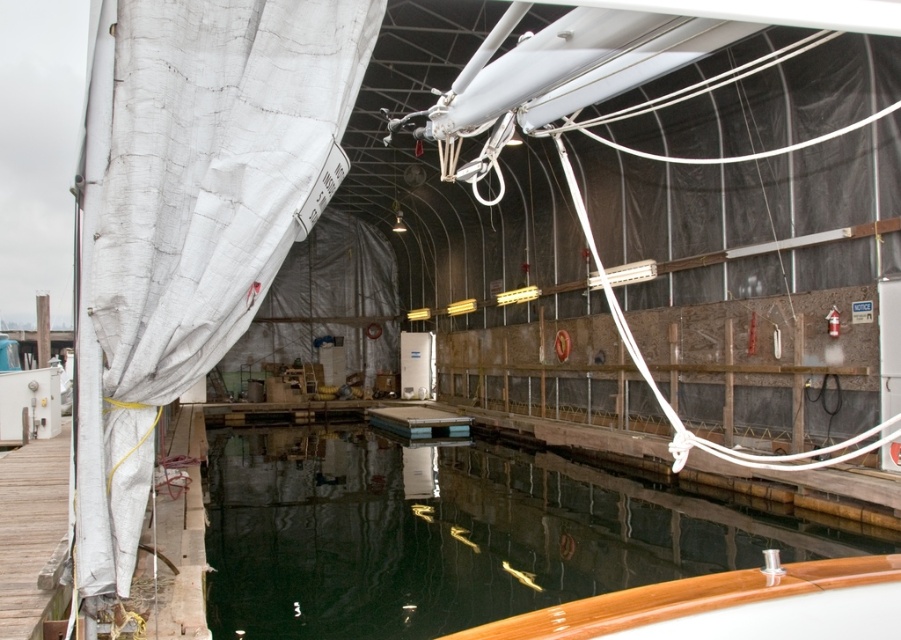
Question: Can you confirm if white fabric curtain at left is positioned below glossy wood boat at lower center?

Choices:
 (A) no
 (B) yes

Answer: (A)

Question: Can you confirm if dark reflective water at center is thinner than glossy wood boat at lower center?

Choices:
 (A) no
 (B) yes

Answer: (A)

Question: Which object is the farthest from the glossy wood boat at lower center?

Choices:
 (A) dark reflective water at center
 (B) white fabric curtain at left

Answer: (A)

Question: Is dark reflective water at center closer to the viewer compared to glossy wood boat at lower center?

Choices:
 (A) yes
 (B) no

Answer: (B)

Question: Which object appears farthest from the camera in this image?

Choices:
 (A) white fabric curtain at left
 (B) dark reflective water at center
 (C) glossy wood boat at lower center

Answer: (B)

Question: Which point appears farthest from the camera in this image?

Choices:
 (A) coord(695,566)
 (B) coord(146,300)
 (C) coord(762,624)

Answer: (A)